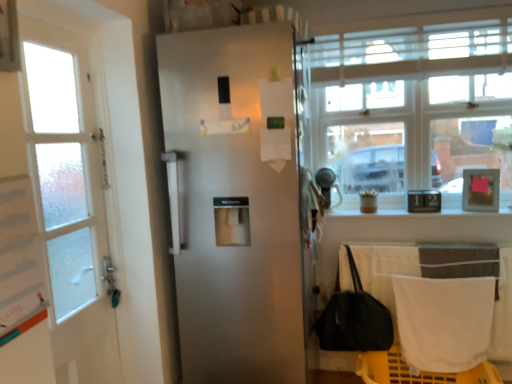
Question: Does clear glass window at upper right turn towards black fabric handbag at lower right?

Choices:
 (A) yes
 (B) no

Answer: (B)

Question: Is clear glass window at upper right shorter than black fabric handbag at lower right?

Choices:
 (A) no
 (B) yes

Answer: (A)

Question: Is clear glass window at upper right next to black fabric handbag at lower right and touching it?

Choices:
 (A) yes
 (B) no

Answer: (B)

Question: Is the depth of clear glass window at upper right less than that of black fabric handbag at lower right?

Choices:
 (A) yes
 (B) no

Answer: (B)

Question: Is clear glass window at upper right smaller than black fabric handbag at lower right?

Choices:
 (A) no
 (B) yes

Answer: (A)

Question: From the image's perspective, is clear glass window at upper right above or below black fabric handbag at lower right?

Choices:
 (A) above
 (B) below

Answer: (A)

Question: Is clear glass window at upper right bigger or smaller than black fabric handbag at lower right?

Choices:
 (A) big
 (B) small

Answer: (A)

Question: Is clear glass window at upper right in front of or behind black fabric handbag at lower right in the image?

Choices:
 (A) behind
 (B) front

Answer: (A)

Question: Would you say clear glass window at upper right is inside or outside black fabric handbag at lower right?

Choices:
 (A) inside
 (B) outside

Answer: (B)

Question: Choose the correct answer: Is satin white refrigerator at center inside white fabric towel at lower right or outside it?

Choices:
 (A) outside
 (B) inside

Answer: (A)

Question: Does point (276, 36) appear closer or farther from the camera than point (430, 364)?

Choices:
 (A) farther
 (B) closer

Answer: (B)

Question: Is satin white refrigerator at center in front of or behind white fabric towel at lower right in the image?

Choices:
 (A) behind
 (B) front

Answer: (B)

Question: From the image's perspective, is satin white refrigerator at center above or below white fabric towel at lower right?

Choices:
 (A) below
 (B) above

Answer: (B)

Question: From the image's perspective, relative to clear glass window at upper right, is black fabric handbag at lower right above or below?

Choices:
 (A) below
 (B) above

Answer: (A)

Question: In terms of height, does black fabric handbag at lower right look taller or shorter compared to clear glass window at upper right?

Choices:
 (A) short
 (B) tall

Answer: (A)